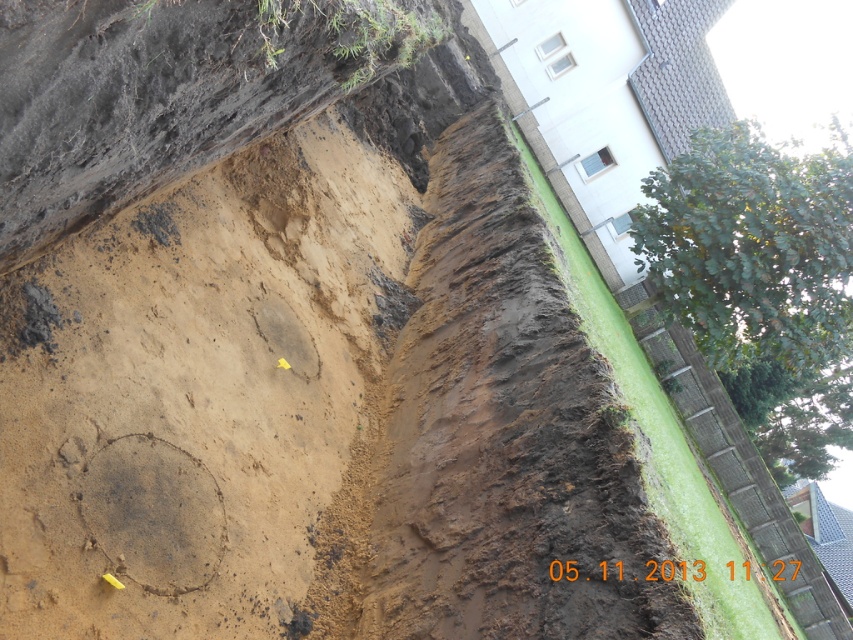
You are a construction worker who needs to place a new marker between the two existing yellow markers in the trench. The trench has brown sandy mud at center and brown muddy soil at center. Which direction should you place the new marker to ensure it is between the two existing markers?

The brown sandy mud at center is to the left of brown muddy soil at center, so place the new marker between them by positioning it to the right of the brown sandy mud at center and to the left of the brown muddy soil at center.

You are an engineer inspecting the construction site. You need to locate the brown sandy mud at center. According to the coordinates provided, where exactly is it positioned?

The brown sandy mud at center is located at point coordinates (196, 392).

You are an engineer inspecting the construction site. You notice two areas of soil in the trench labeled as brown sandy mud at center and brown muddy soil at center. Which of these two areas has a larger surface area?

The brown sandy mud at center has a larger surface area than the brown muddy soil at center.